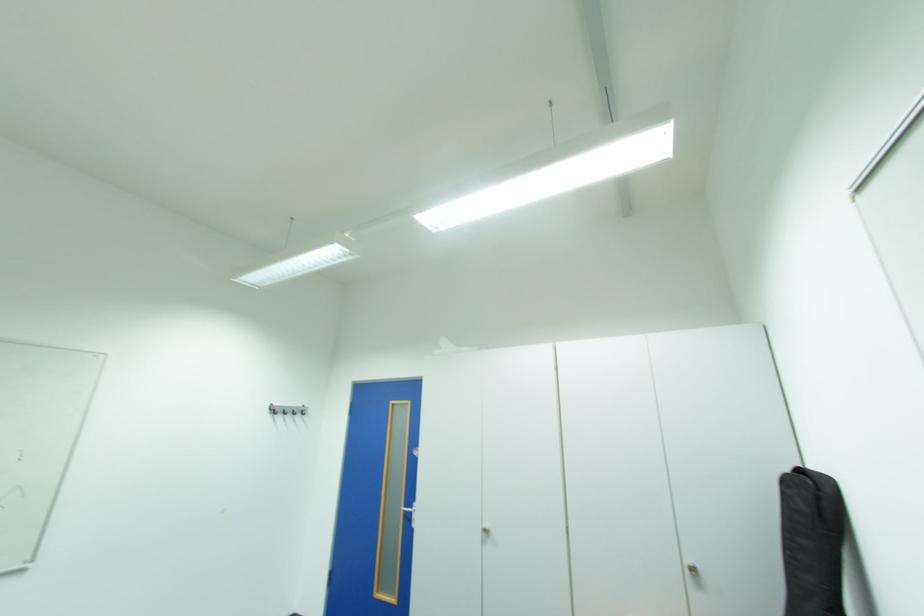
In order to click on silver wall hook in this screenshot , I will do `click(286, 410)`.